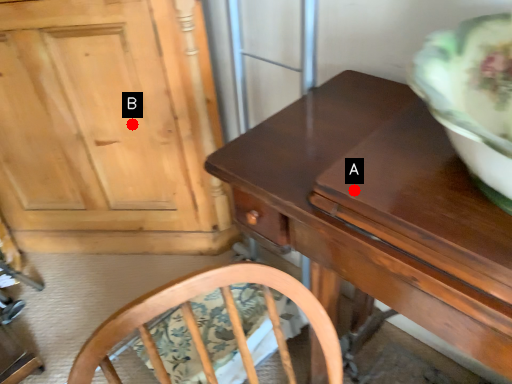
Question: Two points are circled on the image, labeled by A and B beside each circle. Which point appears farthest from the camera in this image?

Choices:
 (A) A is further
 (B) B is further

Answer: (B)